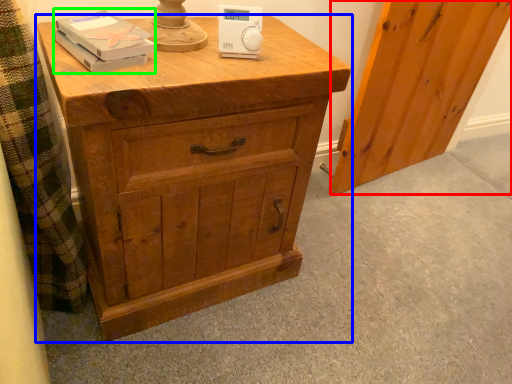
Question: Which is farther away from screen door (highlighted by a red box)? chest of drawers (highlighted by a blue box) or book (highlighted by a green box)?

Choices:
 (A) chest of drawers
 (B) book

Answer: (B)